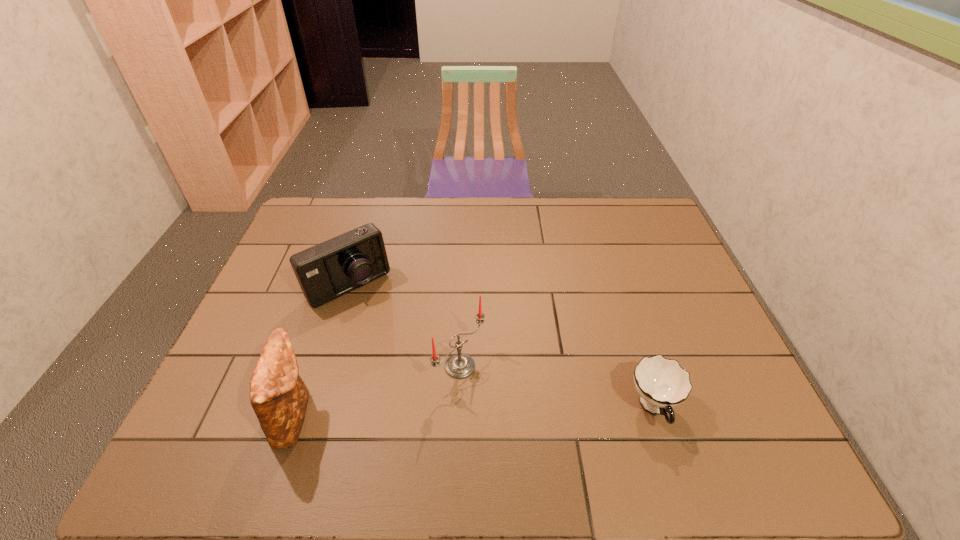
Find the location of a particular element. blank space at the far right corner of the desktop is located at coordinates (635, 227).

At what (x,y) coordinates should I click in order to perform the action: click on vacant area that lies between the farthest object and the clutch bag. Please return your answer as a coordinate pair (x, y). The width and height of the screenshot is (960, 540). Looking at the image, I should click on (322, 351).

In order to click on vacant space in between the shortest object and the camera in this screenshot , I will do `click(501, 347)`.

You are a GUI agent. You are given a task and a screenshot of the screen. Output one action in this format:
    pyautogui.click(x=<x>, y=<y>)
    Task: Click on the free space between the camera and the clutch bag
    The height and width of the screenshot is (540, 960).
    Given the screenshot: What is the action you would take?
    pyautogui.click(x=322, y=351)

Find the location of `vacant point located between the third object from left to right and the camera`. vacant point located between the third object from left to right and the camera is located at coordinates pyautogui.click(x=404, y=326).

Identify the location of free space between the shortest object and the camera. The width and height of the screenshot is (960, 540). (501, 347).

The width and height of the screenshot is (960, 540). Identify the location of vacant region between the third object from left to right and the cup. (557, 387).

Locate an element on the screen. The height and width of the screenshot is (540, 960). free point between the camera and the clutch bag is located at coordinates (322, 351).

This screenshot has width=960, height=540. In order to click on empty space that is in between the rightmost object and the clutch bag in this screenshot , I will do `click(474, 412)`.

Where is `vacant area that lies between the clutch bag and the camera`? vacant area that lies between the clutch bag and the camera is located at coordinates (322, 351).